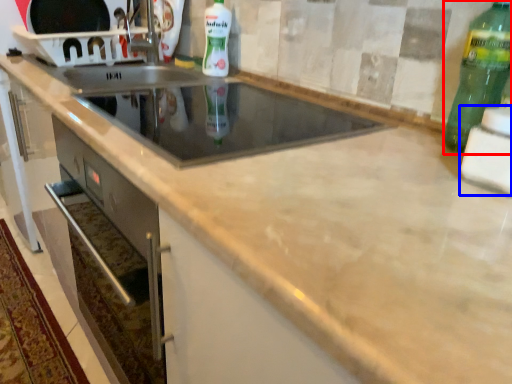
Question: Which object appears closest to the camera in this image, bottle (highlighted by a red box) or appliance (highlighted by a blue box)?

Choices:
 (A) bottle
 (B) appliance

Answer: (B)